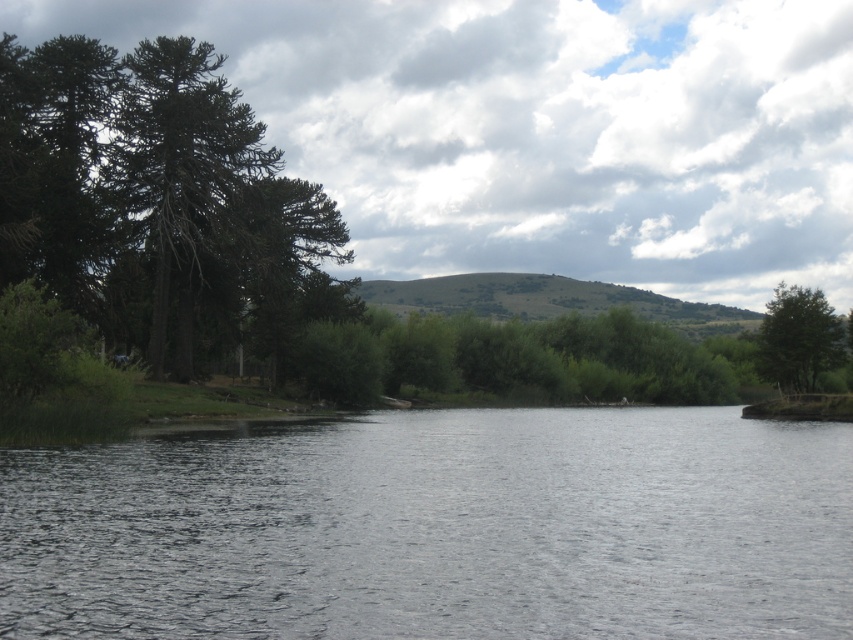
You are standing at the point with coordinates point (788,365) and want to walk towards the point (515,461). Based on the scene, will you be walking towards the water or away from it?

Since point (515,461) is in front of point (788,365), walking towards it means you are moving closer to the water.

You are standing on the shore looking at the clear water at center and the green rough bark tree at left. Which object is closer to the ground?

The clear water at center is located below green rough bark tree at left, so the clear water at center is closer to the ground.